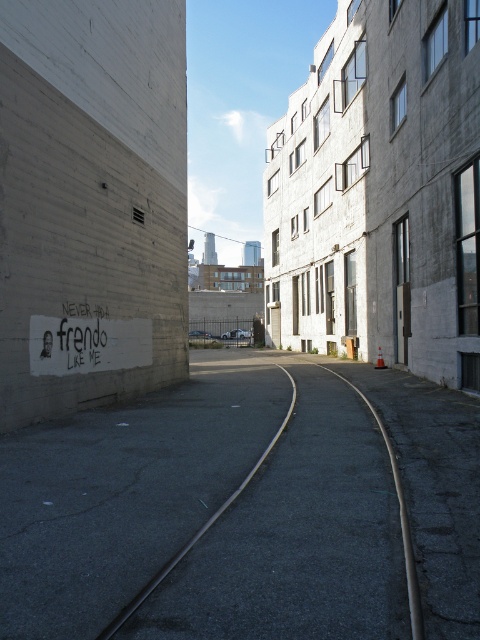
Question: Can you confirm if black asphalt track at center is smaller than white matte text at center?

Choices:
 (A) yes
 (B) no

Answer: (B)

Question: Is black asphalt track at center positioned behind white matte text at center?

Choices:
 (A) yes
 (B) no

Answer: (B)

Question: Does black asphalt track at center have a greater width compared to white matte text at center?

Choices:
 (A) no
 (B) yes

Answer: (B)

Question: Which object is closer to the camera taking this photo?

Choices:
 (A) white matte text at center
 (B) black asphalt track at center

Answer: (B)

Question: Which point is farther from the camera taking this photo?

Choices:
 (A) (411, 548)
 (B) (101, 332)

Answer: (B)

Question: Which point is farther to the camera?

Choices:
 (A) (402, 513)
 (B) (71, 371)

Answer: (B)